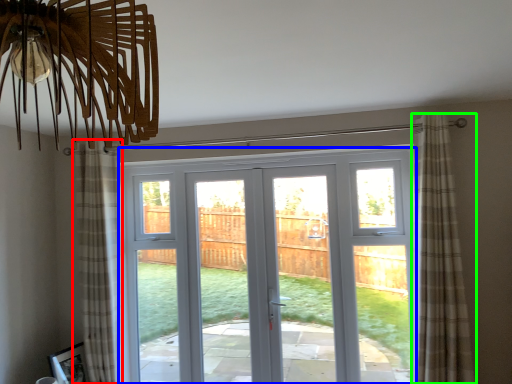
Question: Based on their relative distances, which object is farther from curtain (highlighted by a red box)? Choose from door (highlighted by a blue box) and curtain (highlighted by a green box).

Choices:
 (A) door
 (B) curtain

Answer: (A)